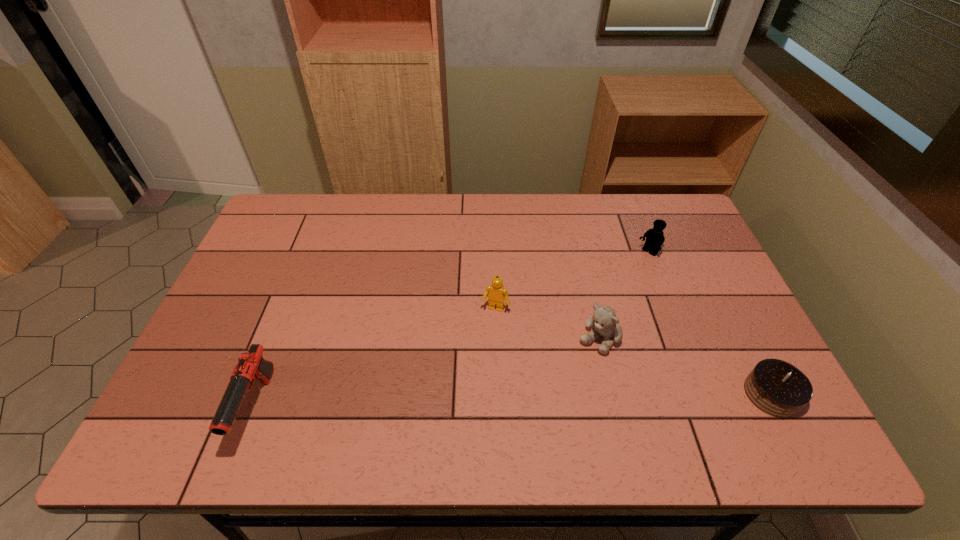
Identify the location of free space on the desktop that is between the leftmost object and the chocolate cake and is positioned on the face of the nearer Lego. The width and height of the screenshot is (960, 540). (463, 402).

You are a GUI agent. You are given a task and a screenshot of the screen. Output one action in this format:
    pyautogui.click(x=<x>, y=<y>)
    Task: Click on the free spot on the desktop that is between the leftmost object and the chocolate cake and is positioned on the face of the teddy bear
    The height and width of the screenshot is (540, 960).
    Given the screenshot: What is the action you would take?
    pyautogui.click(x=549, y=400)

This screenshot has width=960, height=540. In order to click on free space on the desktop that is between the gun and the chocolate cake and is positioned on the front-facing side of the farthest object in this screenshot , I will do `click(467, 402)`.